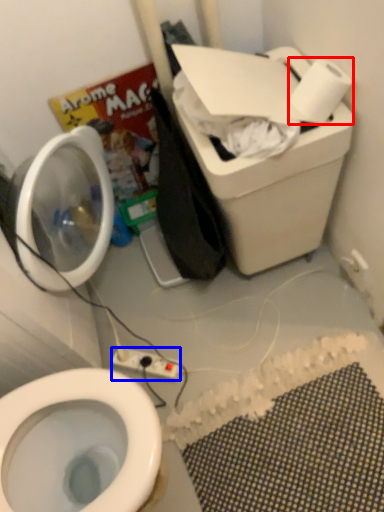
Question: Which object appears farthest to the camera in this image, toilet paper (highlighted by a red box) or electric outlet (highlighted by a blue box)?

Choices:
 (A) toilet paper
 (B) electric outlet

Answer: (B)